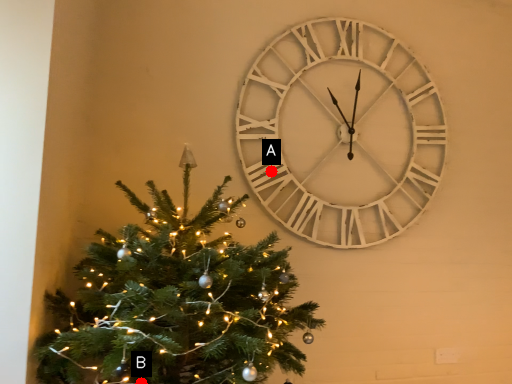
Question: Two points are circled on the image, labeled by A and B beside each circle. Among these points, which one is nearest to the camera?

Choices:
 (A) A is closer
 (B) B is closer

Answer: (B)